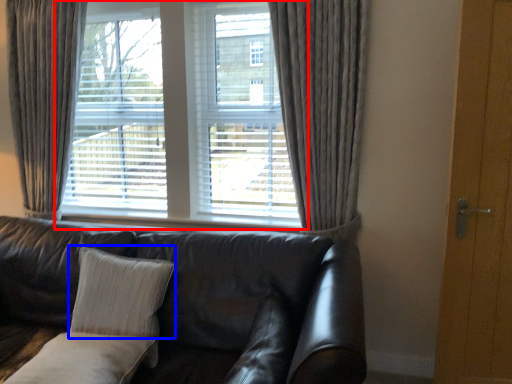
Question: Which point is closer to the camera, window (highlighted by a red box) or pillow (highlighted by a blue box)?

Choices:
 (A) window
 (B) pillow

Answer: (B)